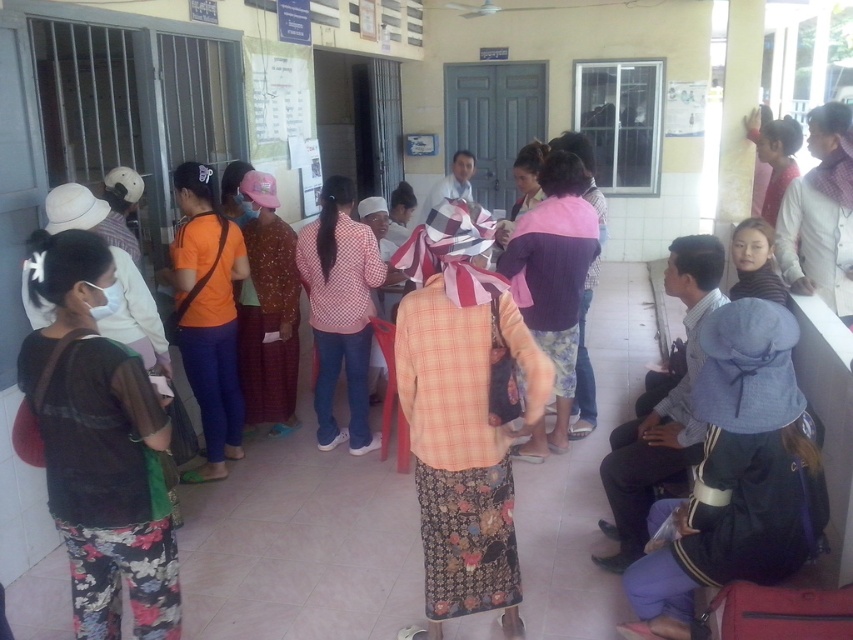
Question: From the image, what is the correct spatial relationship of blue fabric jacket at lower right in relation to pink fabric at center?

Choices:
 (A) right
 (B) left

Answer: (A)

Question: Among these objects, which one is nearest to the camera?

Choices:
 (A) black sheer blouse at left
 (B) pink checkered shirt at center
 (C) orange fabric shirt at center
 (D) pink woolen shawl at center

Answer: (A)

Question: Based on their relative distances, which object is farther from the plaid fabric shirt at center?

Choices:
 (A) black sheer blouse at left
 (B) orange fabric shirt at center
 (C) blue fabric jacket at lower right
 (D) pink woolen shawl at center

Answer: (B)

Question: Is plaid fabric shirt at center thinner than pink checkered shirt at center?

Choices:
 (A) yes
 (B) no

Answer: (A)

Question: Is plaid fabric shirt at center above orange fabric shirt at center?

Choices:
 (A) yes
 (B) no

Answer: (B)

Question: Which point appears farthest from the camera in this image?

Choices:
 (A) (498, 390)
 (B) (358, 392)
 (C) (236, 275)

Answer: (B)